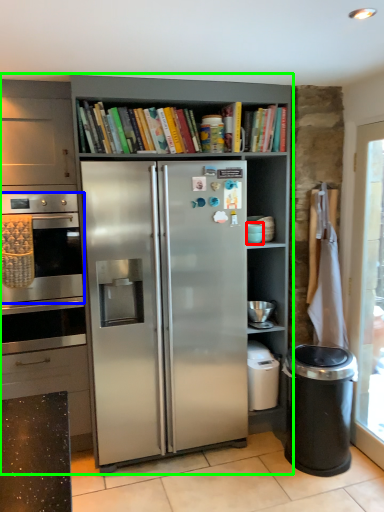
Question: Based on their relative distances, which object is farther from appliance (highlighted by a red box)? Choose from oven (highlighted by a blue box) and cupboard (highlighted by a green box).

Choices:
 (A) oven
 (B) cupboard

Answer: (A)